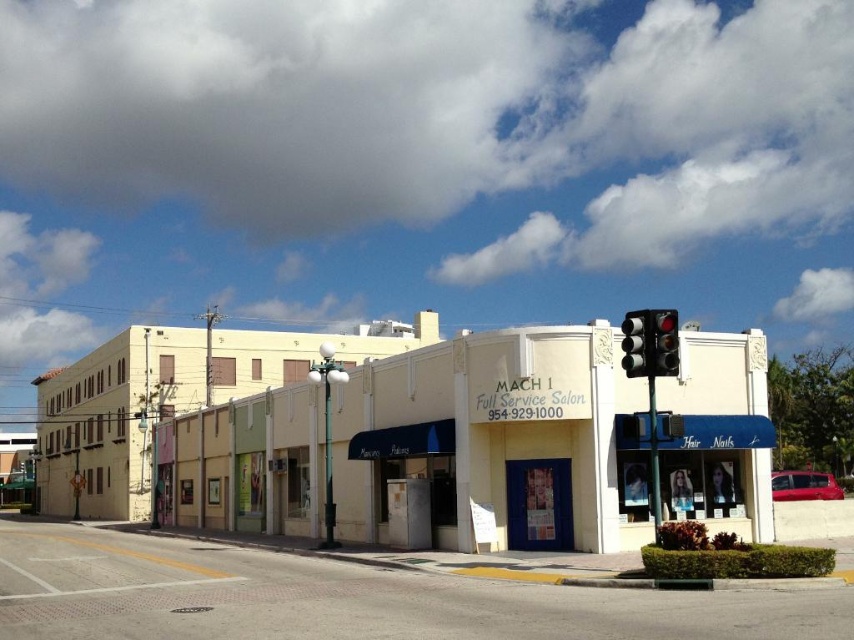
Question: In this image, where is metallic traffic light at upper right located relative to red glass traffic light at upper right?

Choices:
 (A) below
 (B) above

Answer: (B)

Question: Which point appears farthest from the camera in this image?

Choices:
 (A) (659, 364)
 (B) (342, 388)
 (C) (648, 323)

Answer: (B)

Question: Which point is closer to the camera?

Choices:
 (A) black glass traffic light at upper right
 (B) metallic traffic light at upper right
 (C) beige concrete mach 1 full service salon at center

Answer: (B)

Question: Does red glass traffic light at upper right have a smaller size compared to black glass traffic light at upper right?

Choices:
 (A) yes
 (B) no

Answer: (A)

Question: From the image, what is the correct spatial relationship of metallic traffic light at upper right in relation to red glass traffic light at upper right?

Choices:
 (A) above
 (B) below

Answer: (A)

Question: Estimate the real-world distances between objects in this image. Which object is closer to the red glass traffic light at upper right?

Choices:
 (A) black glass traffic light at upper right
 (B) metallic traffic light at upper right

Answer: (B)